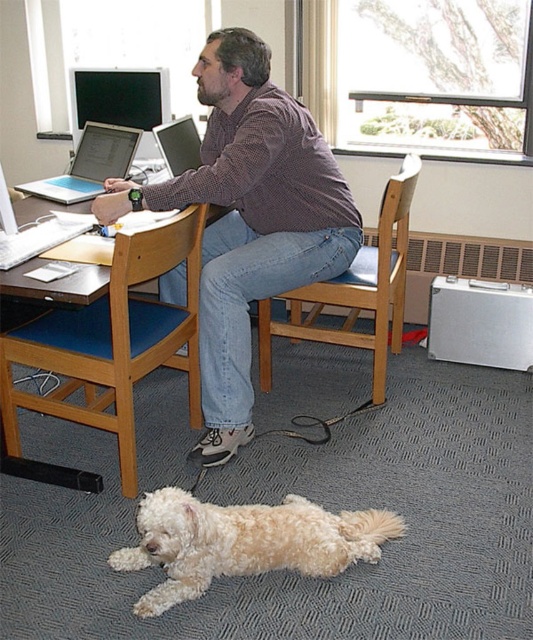
Does matte black monitor at upper left have a smaller size compared to silver metallic laptop at center?

Indeed, matte black monitor at upper left has a smaller size compared to silver metallic laptop at center.

At what (x,y) coordinates should I click in order to perform the action: click on matte black monitor at upper left. Please return your answer as a coordinate pair (x, y). The height and width of the screenshot is (640, 533). Looking at the image, I should click on (120, 100).

Is point (158, 68) positioned after point (94, 179)?

Yes.

I want to click on matte black monitor at upper left, so click(120, 100).

Between matte brown shirt at center and white fluffy dog at lower center, which one appears on the left side from the viewer's perspective?

matte brown shirt at center

Can you confirm if matte brown shirt at center is positioned below white fluffy dog at lower center?

Actually, matte brown shirt at center is above white fluffy dog at lower center.

Image resolution: width=533 pixels, height=640 pixels. What do you see at coordinates (248, 220) in the screenshot?
I see `matte brown shirt at center` at bounding box center [248, 220].

Where is `matte brown shirt at center`? The width and height of the screenshot is (533, 640). matte brown shirt at center is located at coordinates (248, 220).

Is brown wood computer desk at center shorter than white fluffy dog at lower center?

In fact, brown wood computer desk at center may be taller than white fluffy dog at lower center.

Between brown wood computer desk at center and white fluffy dog at lower center, which one is positioned higher?

Positioned higher is brown wood computer desk at center.

Is point (187, 358) less distant than point (213, 508)?

No, it is behind (213, 508).

What are the coordinates of `brown wood computer desk at center` in the screenshot? It's located at (114, 340).